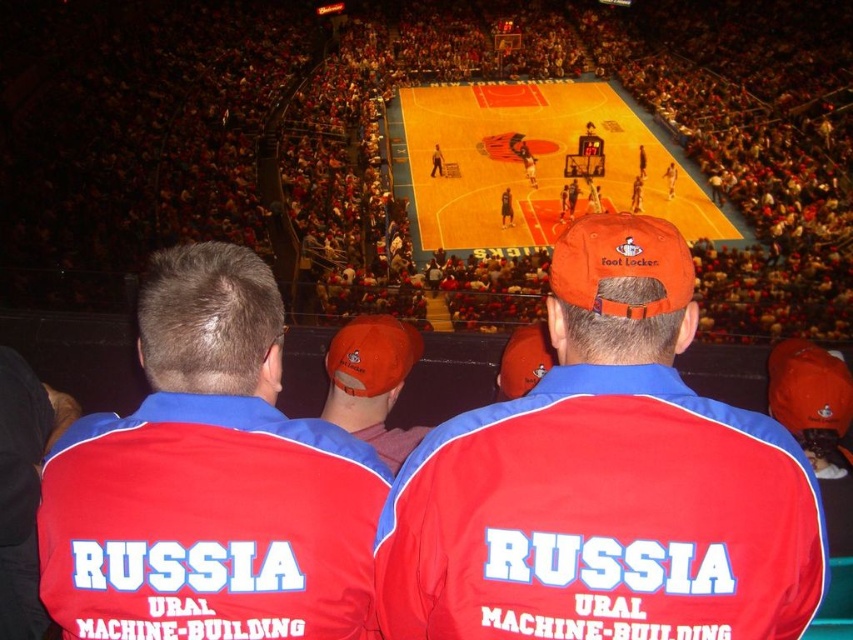
You are a photographer standing behind the crowd watching the basketball game. You notice two items at the center of the scene. Which one is positioned to the right? The items are the matte red cap at center and the red fabric jacket at center.

The matte red cap at center is positioned to the right of the red fabric jacket at center.

You are standing at the entrance of the arena and want to locate the red fabric jacket at center. According to the coordinates provided, in which direction should you look to find it?

The red fabric jacket at center is located at coordinates point (207,481). Since the coordinate system typically has (0,0) at the bottom left corner, 0.753 on the x axis means it is towards the right side of the image, and 0.245 on the y axis means it is towards the upper part of the image. Therefore, you should look towards the upper right direction to find the red fabric jacket at center.

Looking at this image, you are a photographer trying to capture a photo of the orange polished wood basketball court at center. However, there is a red fabric jacket at center blocking your view. Can you estimate whether the jacket is large enough to completely block the court from your camera angle?

The red fabric jacket at center has a smaller size compared to orange polished wood basketball court at center, so it is not large enough to completely block the court from your camera angle.